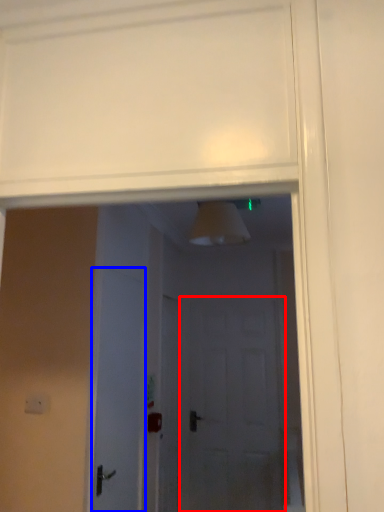
Question: Among these objects, which one is farthest to the camera, screen door (highlighted by a red box) or door (highlighted by a blue box)?

Choices:
 (A) screen door
 (B) door

Answer: (A)